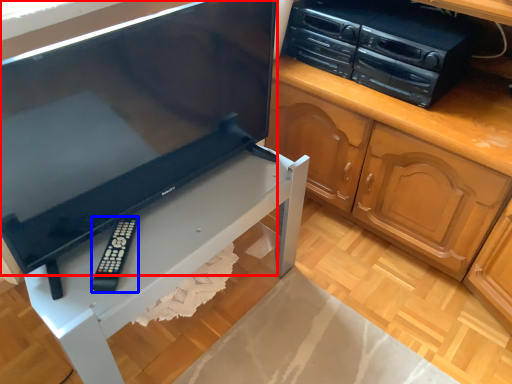
Question: Which object appears closest to the camera in this image, television (highlighted by a red box) or remote (highlighted by a blue box)?

Choices:
 (A) television
 (B) remote

Answer: (A)